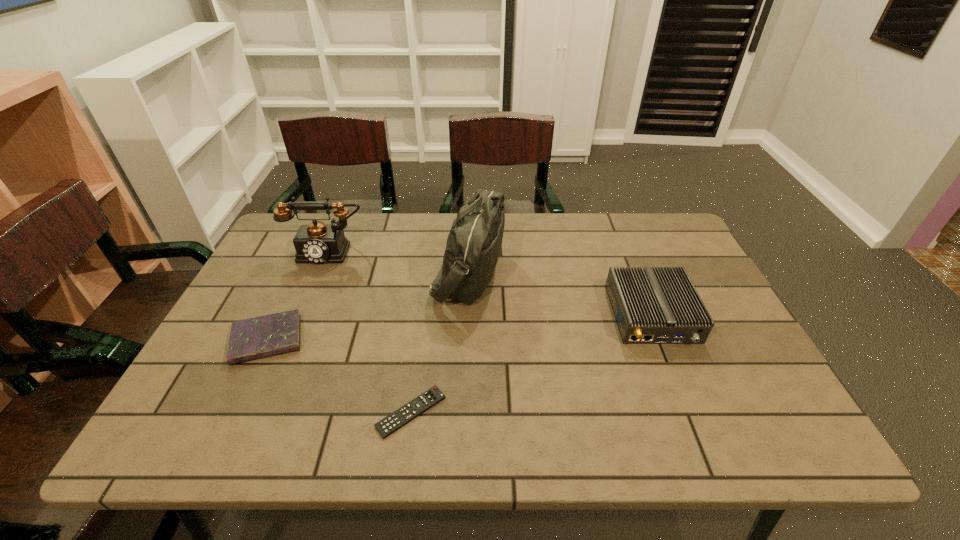
The width and height of the screenshot is (960, 540). In order to click on the tallest object in this screenshot , I will do `click(473, 247)`.

Find the location of a particular element. The width and height of the screenshot is (960, 540). telephone is located at coordinates (317, 243).

The width and height of the screenshot is (960, 540). I want to click on the rightmost object, so [651, 305].

Image resolution: width=960 pixels, height=540 pixels. In order to click on router in this screenshot , I will do `click(651, 305)`.

Where is `diary`? This screenshot has height=540, width=960. diary is located at coordinates (255, 338).

Locate an element on the screen. Image resolution: width=960 pixels, height=540 pixels. remote control is located at coordinates (402, 416).

The width and height of the screenshot is (960, 540). I want to click on the nearest object, so click(402, 416).

The width and height of the screenshot is (960, 540). In order to click on vacant space situated 0.110m at the front padded panel of the tallest object in this screenshot , I will do `click(541, 272)`.

Locate an element on the screen. The image size is (960, 540). vacant space located 0.120m on the front of the fourth shortest object at the rotary dial is located at coordinates (309, 294).

The width and height of the screenshot is (960, 540). I want to click on blank area located on the back panel of the router, so click(702, 438).